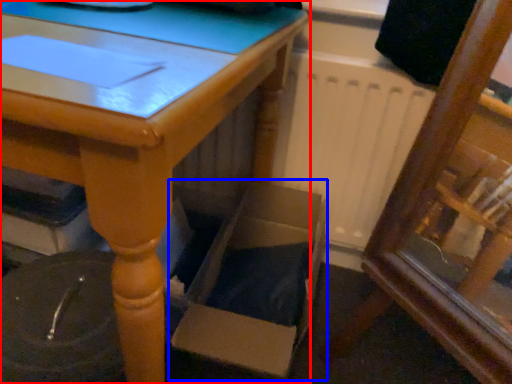
Question: Which object is further to the camera taking this photo, table (highlighted by a red box) or cardboard box (highlighted by a blue box)?

Choices:
 (A) table
 (B) cardboard box

Answer: (B)